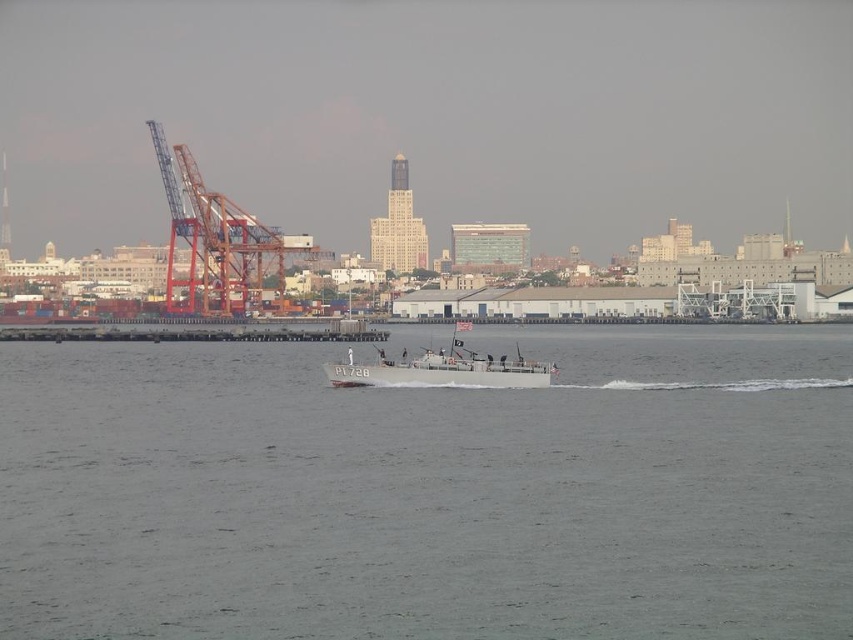
Who is lower down, gray water at center or metallic orange crane at left?

gray water at center is below.

This screenshot has height=640, width=853. What do you see at coordinates (431, 492) in the screenshot?
I see `gray water at center` at bounding box center [431, 492].

Where is `gray water at center`? This screenshot has height=640, width=853. gray water at center is located at coordinates (431, 492).

Does gray water at center appear on the left side of gray metallic boat at center?

Yes, gray water at center is to the left of gray metallic boat at center.

Is point (726, 326) more distant than point (500, 365)?

That is True.

The width and height of the screenshot is (853, 640). What are the coordinates of `gray water at center` in the screenshot? It's located at (431, 492).

Describe the element at coordinates (213, 243) in the screenshot. I see `metallic orange crane at left` at that location.

Can you confirm if metallic orange crane at left is positioned to the right of gray metallic boat at center?

In fact, metallic orange crane at left is to the left of gray metallic boat at center.

Where is `metallic orange crane at left`? metallic orange crane at left is located at coordinates (213, 243).